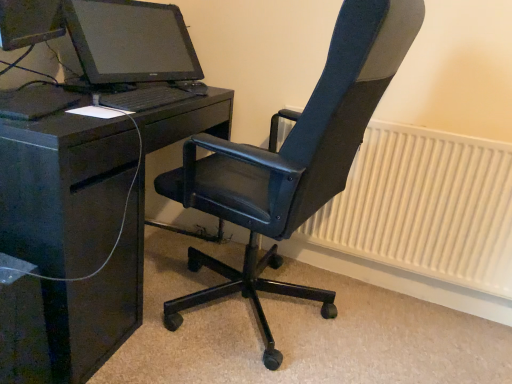
Question: Considering the positions of white textured radiator at right and matte black monitor at upper left in the image, is white textured radiator at right taller or shorter than matte black monitor at upper left?

Choices:
 (A) tall
 (B) short

Answer: (A)

Question: From the image's perspective, is white textured radiator at right positioned above or below matte black monitor at upper left?

Choices:
 (A) below
 (B) above

Answer: (A)

Question: Which is nearer to the black glossy desk at left?

Choices:
 (A) black matte keyboard at center
 (B) white textured radiator at right
 (C) black leather office chair at center
 (D) matte black monitor at upper left

Answer: (A)

Question: Which object is the closest to the white textured radiator at right?

Choices:
 (A) black matte keyboard at center
 (B) black glossy desk at left
 (C) matte black monitor at upper left
 (D) black leather office chair at center

Answer: (D)